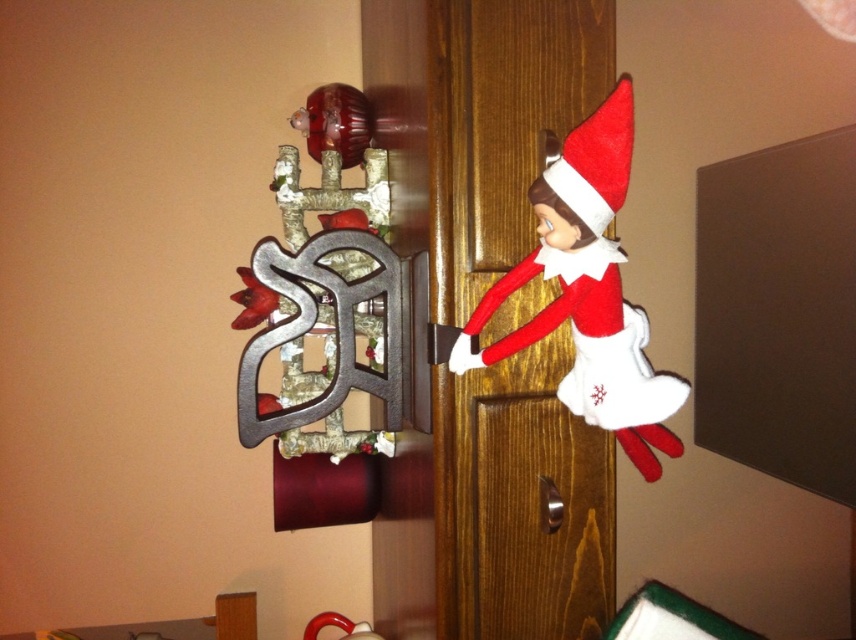
Question: Which of the following is the farthest from the observer?

Choices:
 (A) (492, 449)
 (B) (557, 508)

Answer: (A)

Question: Where is wooden door at center located in relation to polished silver door handle at center in the image?

Choices:
 (A) below
 (B) above

Answer: (B)

Question: Does wooden door at center appear over polished silver door handle at center?

Choices:
 (A) no
 (B) yes

Answer: (B)

Question: Which of the following is the farthest from the observer?

Choices:
 (A) wooden door at center
 (B) polished silver door handle at center

Answer: (B)

Question: Is wooden door at center to the left of polished silver door handle at center from the viewer's perspective?

Choices:
 (A) yes
 (B) no

Answer: (A)

Question: Which of the following is the farthest from the observer?

Choices:
 (A) wooden door at center
 (B) polished silver door handle at center

Answer: (B)